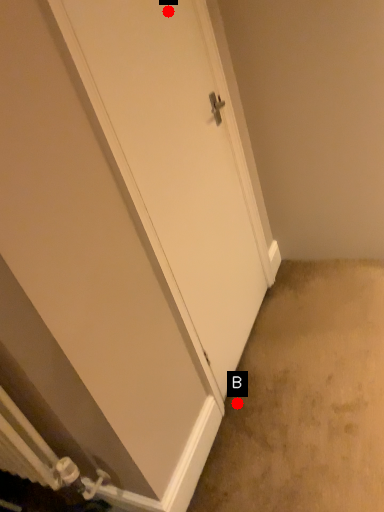
Question: Two points are circled on the image, labeled by A and B beside each circle. Which point appears closest to the camera in this image?

Choices:
 (A) A is closer
 (B) B is closer

Answer: (A)